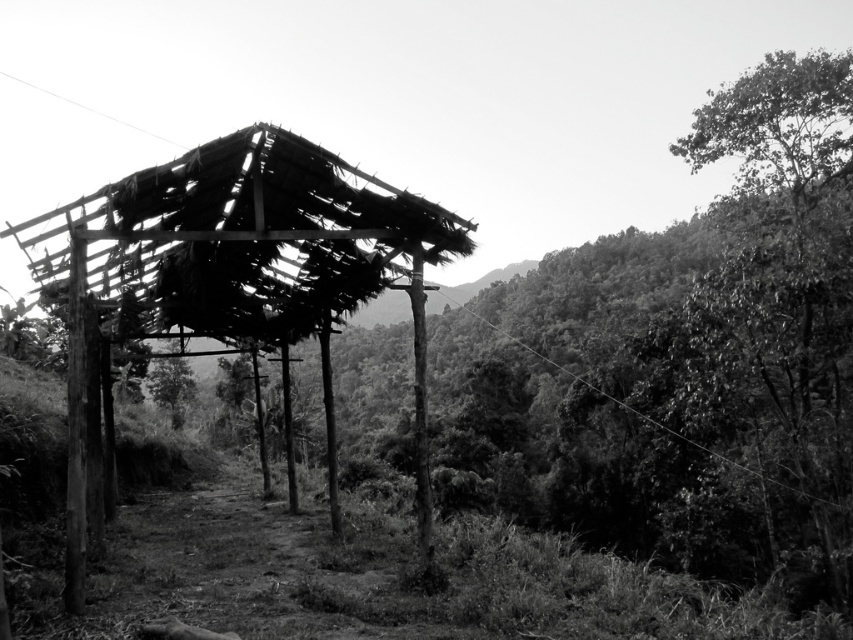
Is wooden hut at center taller than dark green leafy tree at center?

Correct, wooden hut at center is much taller as dark green leafy tree at center.

Who is positioned more to the left, wooden hut at center or dark green leafy tree at center?

dark green leafy tree at center is more to the left.

Between point (140, 262) and point (155, 397), which one is positioned behind?

The point (155, 397) is behind.

Locate an element on the screen. The width and height of the screenshot is (853, 640). wooden hut at center is located at coordinates (224, 264).

Which is behind, point (160, 188) or point (421, 422)?

The point (421, 422) is more distant.

Does wooden hut at center appear on the right side of wooden pole at center?

In fact, wooden hut at center is to the left of wooden pole at center.

Where is `wooden hut at center`? wooden hut at center is located at coordinates (224, 264).

Can you confirm if wooden pole at center is taller than dark green leafy tree at center?

Yes.

The image size is (853, 640). What do you see at coordinates (421, 410) in the screenshot?
I see `wooden pole at center` at bounding box center [421, 410].

Locate an element on the screen. wooden pole at center is located at coordinates (421, 410).